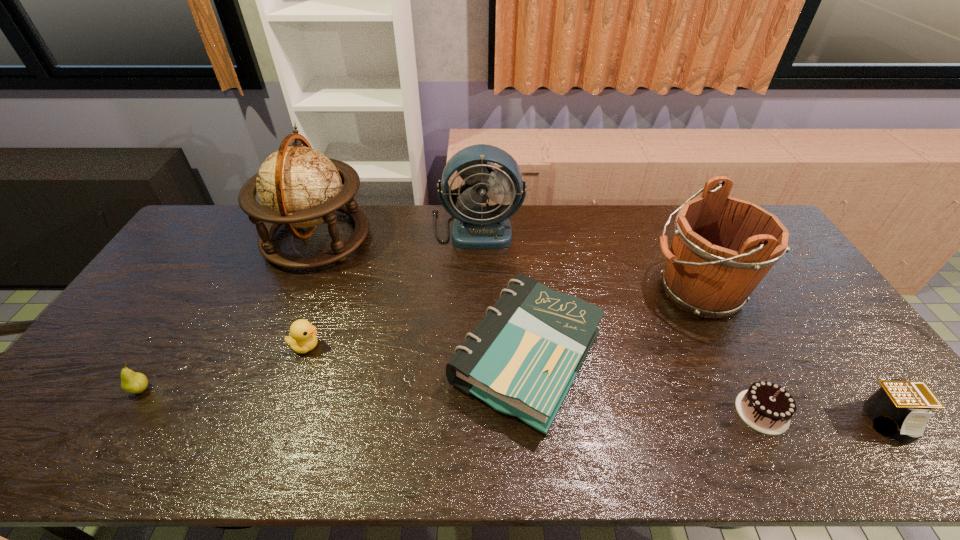
Find the location of a particular element. This screenshot has width=960, height=540. free region that satisfies the following two spatial constraints: 1. in front of the fan to blow air; 2. on the right side of the paperback book is located at coordinates (475, 357).

Where is `free space that satisfies the following two spatial constraints: 1. in front of the fan to blow air; 2. on the face of the duck`? free space that satisfies the following two spatial constraints: 1. in front of the fan to blow air; 2. on the face of the duck is located at coordinates (475, 346).

Identify the location of blank area in the image that satisfies the following two spatial constraints: 1. with the handle on the side of the bucket; 2. on the right side of the rightmost object. (760, 420).